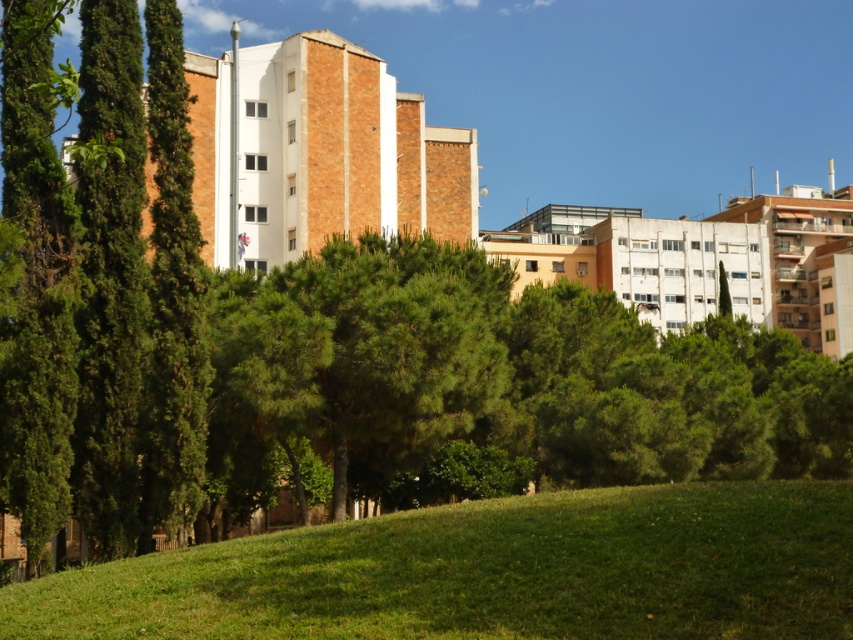
Can you confirm if green grassy hill at lower left is shorter than green needle-like tree at center?

Yes.

Who is positioned more to the right, green grassy hill at lower left or green needle-like tree at center?

green grassy hill at lower left

The width and height of the screenshot is (853, 640). What are the coordinates of `green grassy hill at lower left` in the screenshot? It's located at (490, 572).